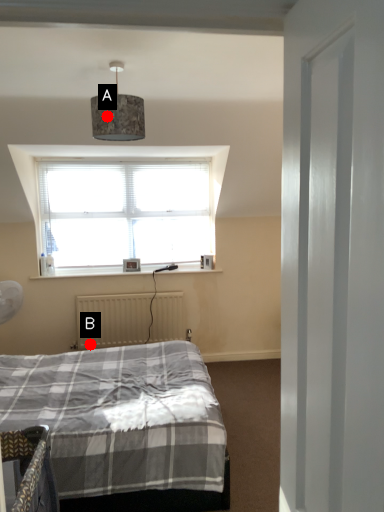
Question: Two points are circled on the image, labeled by A and B beside each circle. Which point is closer to the camera?

Choices:
 (A) A is closer
 (B) B is closer

Answer: (A)